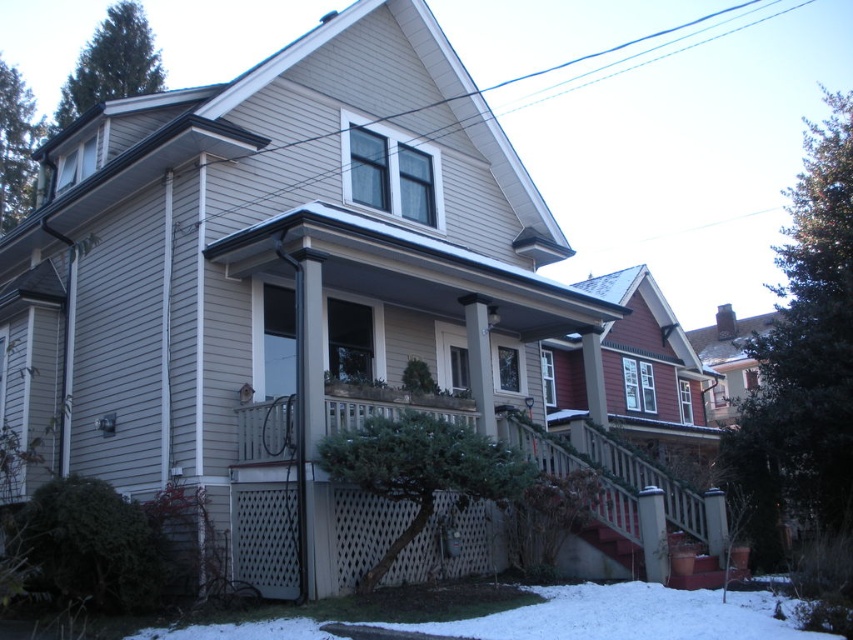
You are standing on the white powdery snow at lower center and want to reach the front door of the house. Which direction should you move to go under the white lattice porch at center?

To reach the front door, you should move towards the white lattice porch at center, which is positioned over the white powdery snow at lower center. Since the porch is above the snow, moving towards it will bring you under its structure and closer to the front door.

You are standing at the point marked as point (x=619, y=483) in the image. What object is directly in front of you?

The white lattice porch at center is directly in front of you at point (x=619, y=483).